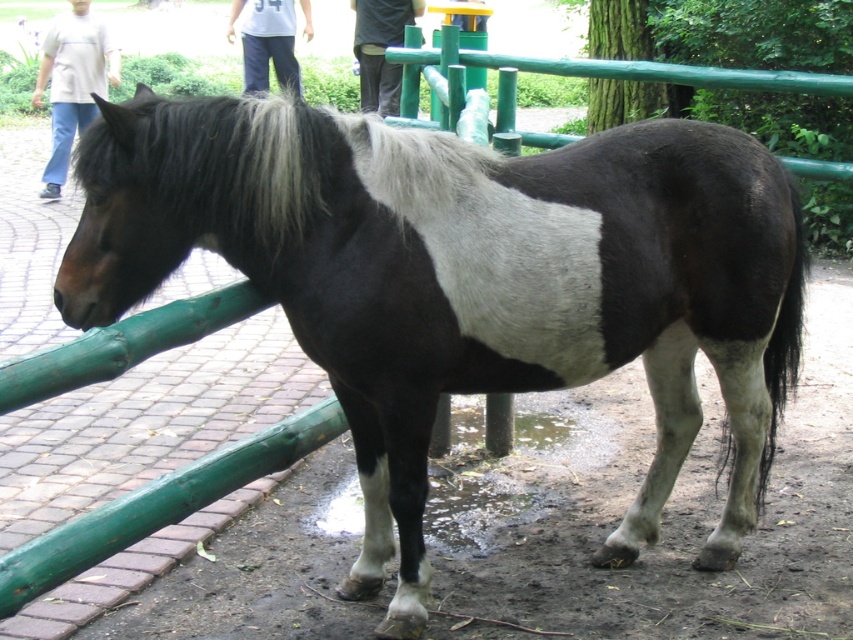
Who is taller, black silky mane at upper left or white cotton shirt at upper left?

With more height is white cotton shirt at upper left.

Which is behind, point (354, 131) or point (74, 19)?

Point (74, 19)

Where is `black silky mane at upper left`? This screenshot has width=853, height=640. black silky mane at upper left is located at coordinates (251, 172).

The width and height of the screenshot is (853, 640). What are the coordinates of `black silky mane at upper left` in the screenshot? It's located at 251,172.

Is white cotton shirt at upper left wider than black pants at center?

Correct, the width of white cotton shirt at upper left exceeds that of black pants at center.

Who is more forward, (55, 61) or (372, 61)?

Point (372, 61) is more forward.

Is point (73, 54) positioned behind point (415, 3)?

That is True.

The height and width of the screenshot is (640, 853). Find the location of `white cotton shirt at upper left`. white cotton shirt at upper left is located at coordinates (73, 83).

Between point (119, 132) and point (247, 20), which one is positioned in front?

Point (119, 132)

Is black silky mane at upper left to the right of white cotton pants at upper center from the viewer's perspective?

Yes, black silky mane at upper left is to the right of white cotton pants at upper center.

Who is more distant from viewer, (125, 240) or (254, 74)?

Positioned behind is point (254, 74).

Locate an element on the screen. The image size is (853, 640). black silky mane at upper left is located at coordinates (251, 172).